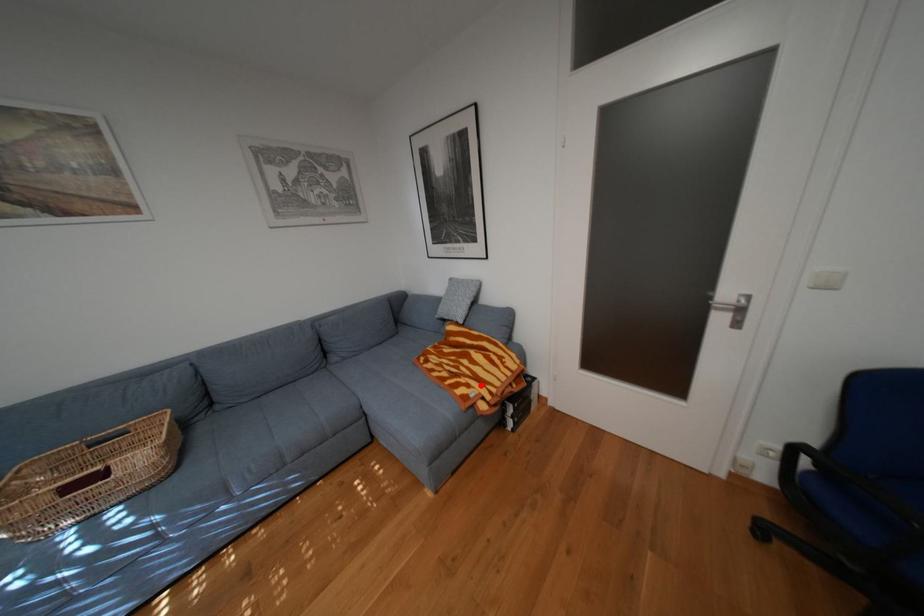
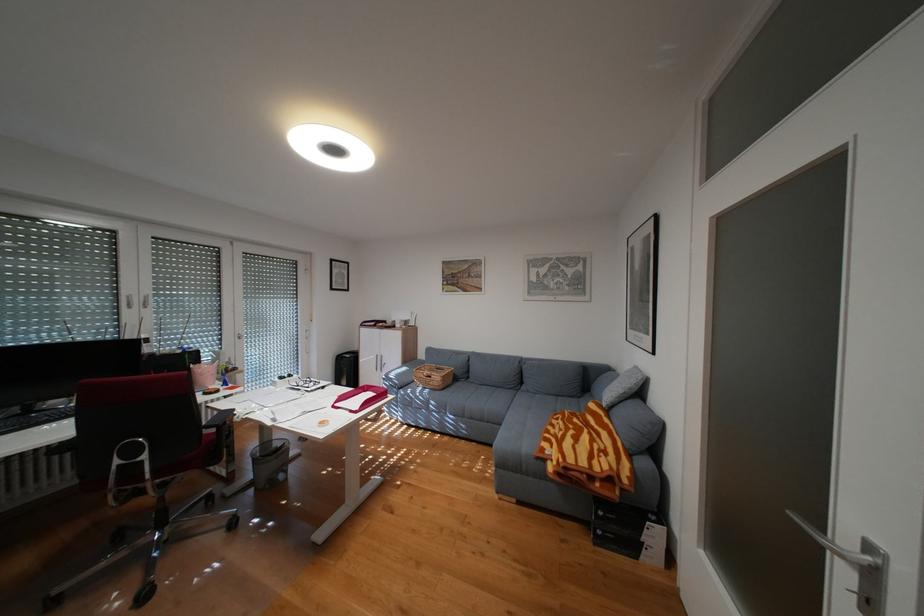
Question: I am providing you with two images of the same scene from different viewpoints. A red point is marked on the first image. Is the red point's position out of view in image 2?

Choices:
 (A) Yes
 (B) No

Answer: (B)